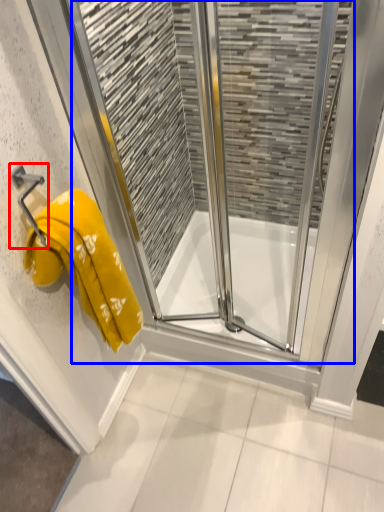
Question: Which of the following is the closest to the observer, towel bar (highlighted by a red box) or screen door (highlighted by a blue box)?

Choices:
 (A) towel bar
 (B) screen door

Answer: (B)